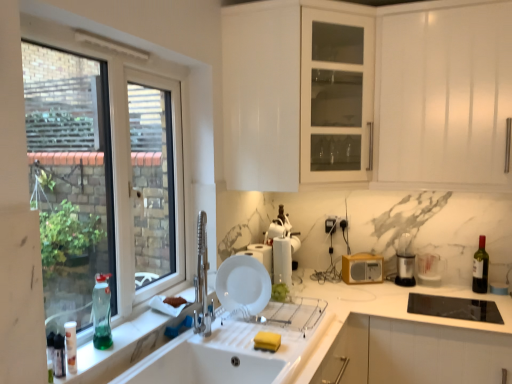
The height and width of the screenshot is (384, 512). What are the coordinates of `vacant area to the right of white glossy kettle at center, which is the 4th appliance from right to left` in the screenshot? It's located at (310, 273).